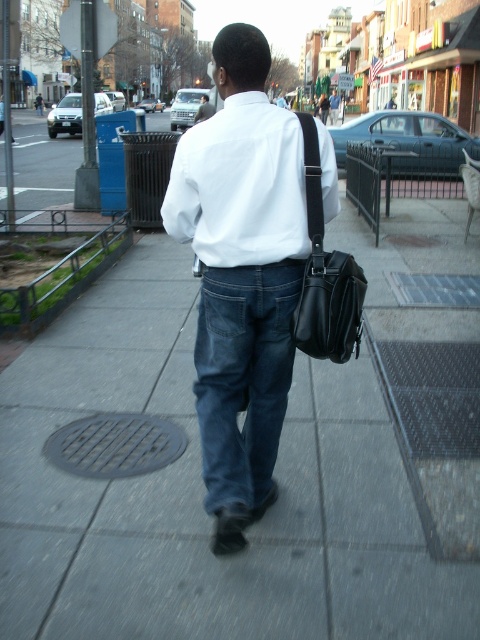
You are standing behind a man walking on the sidewalk. The man is carrying a black shoulder bag. There is a point labeled with coordinates at [275,468]. What is located at this point?

The point at coordinates [275,468] corresponds to the gray concrete sidewalk at center.

You are a delivery robot with a 1.5 meter wide package. You are positioned behind the gray concrete sidewalk at center and need to move forward towards the camera. Can you safely move forward without hitting the camera?

The gray concrete sidewalk at center and camera are 2.19 meters apart from each other. Since the package is 1.5 meters wide, the robot can safely move forward as the distance between them allows enough space for the robot and its package to pass without collision.

You are standing behind a man on the sidewalk. You see the gray concrete sidewalk at center and the matte white shirt at center. Which object is closer to you?

The gray concrete sidewalk at center is closer to you because it is in front of the matte white shirt at center.